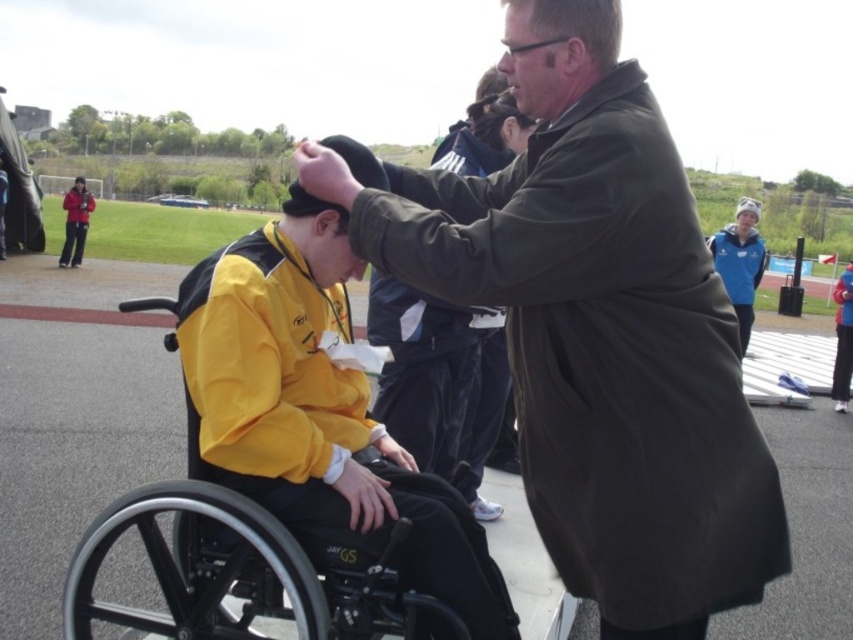
Based on the photo, you are a photographer trying to capture a candid shot of the blue fleece jacket at upper right without including the matte black jacket at left in the frame. Based on their positions, is this possible?

The blue fleece jacket at upper right is in front of the matte black jacket at left, so it is possible to capture the blue fleece jacket at upper right without including the matte black jacket at left in the frame by focusing on the front position of the blue fleece jacket at upper right.

You are a photographer at the event and want to take a photo of both the dark green coat at center and the yellow matte jacket at center. If you want to ensure both are fully visible in the frame, which person should you position closer to the camera?

The dark green coat at center is taller than the yellow matte jacket at center, so you should position the dark green coat at center closer to the camera to ensure both are fully visible in the frame.